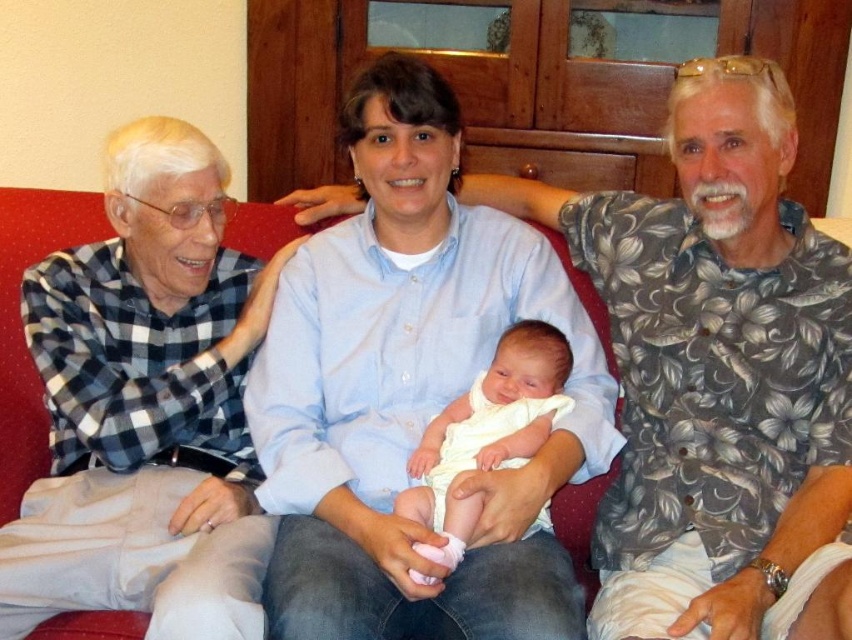
Does checkered fabric shirt at left appear on the right side of white clothed baby at center?

Incorrect, checkered fabric shirt at left is not on the right side of white clothed baby at center.

Between point (251, 545) and point (557, 349), which one is positioned behind?

The point (557, 349) is more distant.

Identify the location of checkered fabric shirt at left. (147, 406).

Does light blue button-down shirt at center appear under white clothed baby at center?

No, light blue button-down shirt at center is not below white clothed baby at center.

Is light blue button-down shirt at center closer to camera compared to white clothed baby at center?

Yes, light blue button-down shirt at center is closer to the viewer.

This screenshot has width=852, height=640. Describe the element at coordinates (412, 392) in the screenshot. I see `light blue button-down shirt at center` at that location.

This screenshot has height=640, width=852. I want to click on light blue button-down shirt at center, so click(x=412, y=392).

Who is positioned more to the right, light blue button-down shirt at center or checkered fabric shirt at left?

From the viewer's perspective, light blue button-down shirt at center appears more on the right side.

Which is above, light blue button-down shirt at center or checkered fabric shirt at left?

Positioned higher is light blue button-down shirt at center.

Between point (436, 371) and point (231, 362), which one is positioned in front?

Point (436, 371) is in front.

The image size is (852, 640). I want to click on light blue button-down shirt at center, so point(412,392).